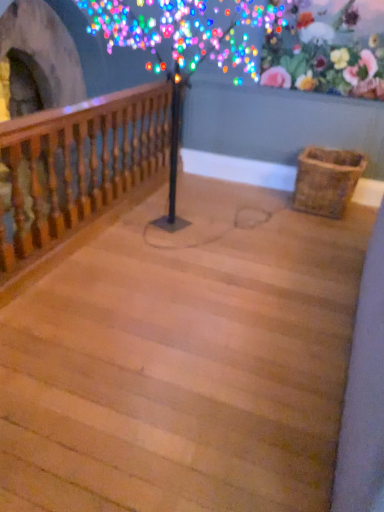
This screenshot has width=384, height=512. In order to click on vacant space that is in between wooden baluster at left and woven brown basket at lower right in this screenshot , I will do `click(188, 218)`.